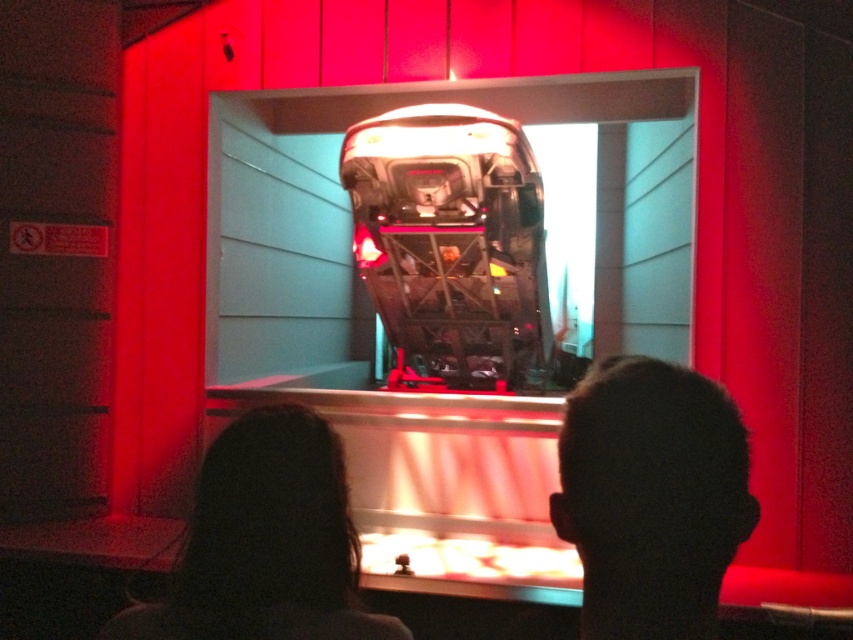
Question: Does silky black hair at center appear under dark brown hair at lower left?

Choices:
 (A) no
 (B) yes

Answer: (A)

Question: Among these objects, which one is farthest from the camera?

Choices:
 (A) dark brown hair at lower left
 (B) silky black hair at center

Answer: (A)

Question: Does silky black hair at center appear over dark brown hair at lower left?

Choices:
 (A) yes
 (B) no

Answer: (A)

Question: Is silky black hair at center thinner than dark brown hair at lower left?

Choices:
 (A) no
 (B) yes

Answer: (B)

Question: Which object appears farthest from the camera in this image?

Choices:
 (A) dark brown hair at lower left
 (B) silky black hair at center

Answer: (A)